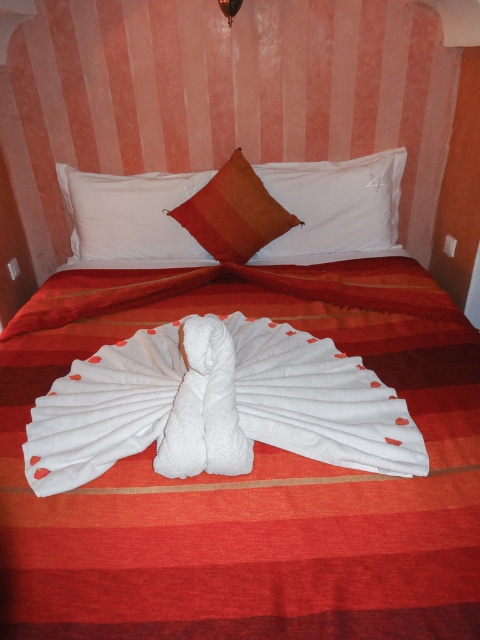
Question: Is white towel at center behind white soft pillow at upper center?

Choices:
 (A) yes
 (B) no

Answer: (B)

Question: Which point is farther to the camera?

Choices:
 (A) white soft pillow at upper center
 (B) white towel at center

Answer: (A)

Question: Is the position of white towel at center more distant than that of white soft pillow at upper center?

Choices:
 (A) no
 (B) yes

Answer: (A)

Question: Which of the following is the closest to the observer?

Choices:
 (A) white soft pillow at upper center
 (B) white towel at center

Answer: (B)

Question: Does white towel at center have a lesser width compared to white soft pillow at upper center?

Choices:
 (A) no
 (B) yes

Answer: (B)